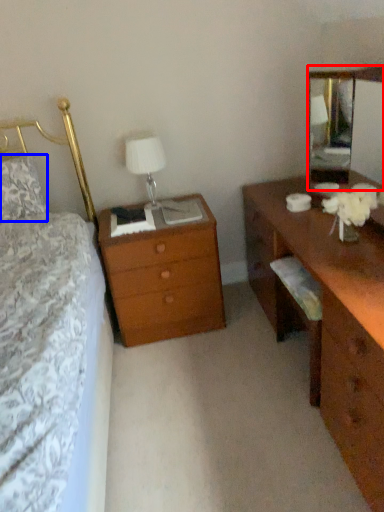
Question: Which object appears closest to the camera in this image, mirror (highlighted by a red box) or pillow (highlighted by a blue box)?

Choices:
 (A) mirror
 (B) pillow

Answer: (A)